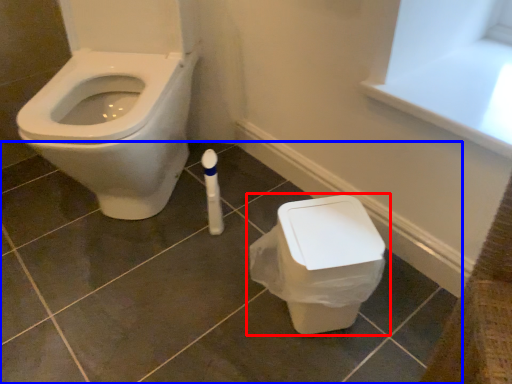
Question: Among these objects, which one is nearest to the camera, toilet (highlighted by a red box) or tile (highlighted by a blue box)?

Choices:
 (A) toilet
 (B) tile

Answer: (B)